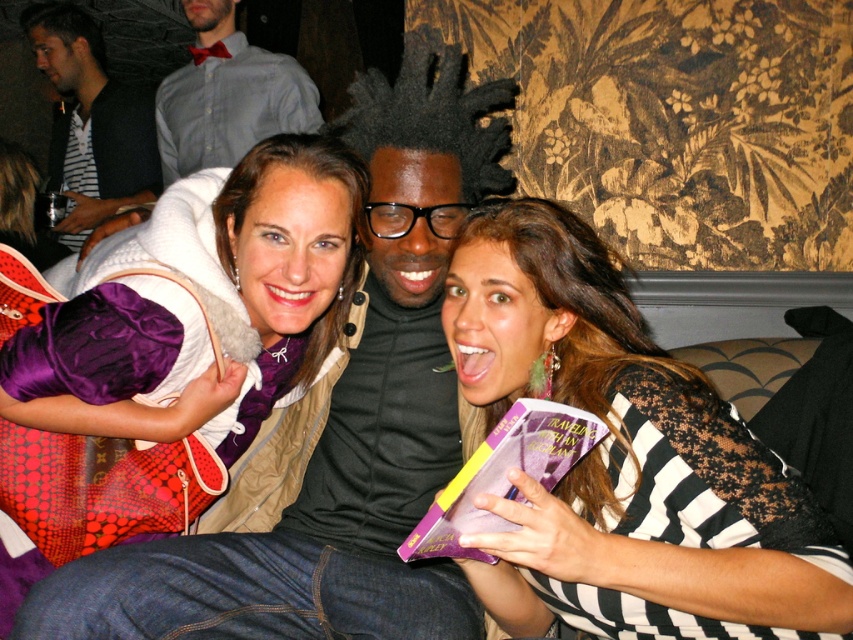
Is the position of matte purple scarf at center less distant than that of purple matte book at center?

No.

Is matte purple scarf at center taller than purple matte book at center?

Correct, matte purple scarf at center is much taller as purple matte book at center.

Locate an element on the screen. The image size is (853, 640). matte purple scarf at center is located at coordinates (206, 301).

Locate an element on the screen. This screenshot has width=853, height=640. matte purple scarf at center is located at coordinates (206, 301).

Which is below, matte purple scarf at center or matte gray shirt at upper left?

matte purple scarf at center

In order to click on matte purple scarf at center in this screenshot , I will do `click(206, 301)`.

Between striped shirt at upper left and purple matte book at center, which one is positioned higher?

striped shirt at upper left is higher up.

Measure the distance from striped shirt at upper left to purple matte book at center.

striped shirt at upper left and purple matte book at center are 8.51 feet apart.

Is point (67, 52) less distant than point (527, 444)?

No, (67, 52) is further to viewer.

You are a GUI agent. You are given a task and a screenshot of the screen. Output one action in this format:
    pyautogui.click(x=<x>, y=<y>)
    Task: Click on the striped shirt at upper left
    This screenshot has height=640, width=853.
    Given the screenshot: What is the action you would take?
    91,122